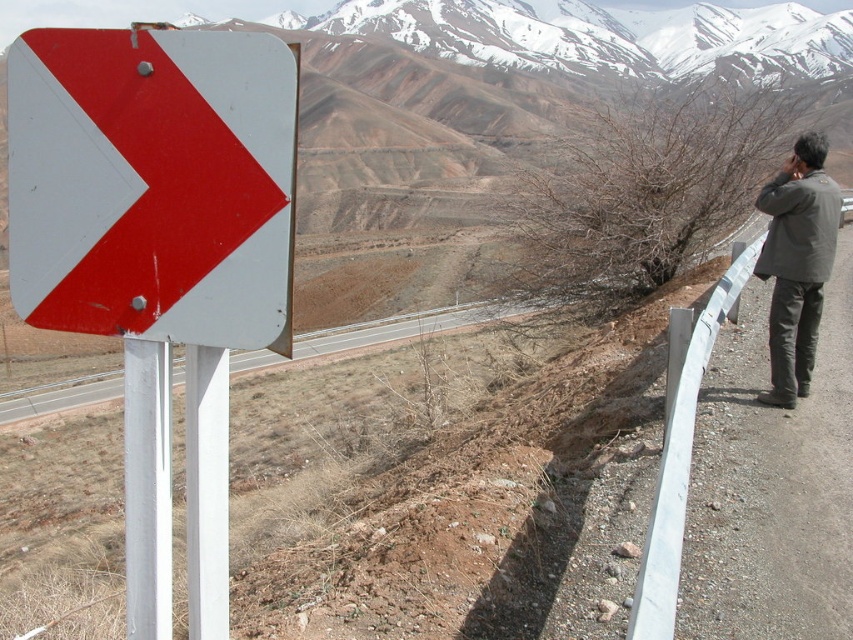
Question: From the image, what is the correct spatial relationship of dark green jacket at right in relation to white metallic pole at left?

Choices:
 (A) right
 (B) left

Answer: (A)

Question: From the image, what is the correct spatial relationship of metallic pole at left in relation to silver metallic guardrail at right?

Choices:
 (A) below
 (B) above

Answer: (A)

Question: Can you confirm if metallic pole at left is thinner than white metallic pole at left?

Choices:
 (A) yes
 (B) no

Answer: (B)

Question: Among these points, which one is nearest to the camera?

Choices:
 (A) (700, 333)
 (B) (283, 180)
 (C) (129, 428)
 (D) (798, 173)

Answer: (B)

Question: Which of the following is the farthest from the observer?

Choices:
 (A) (218, 454)
 (B) (659, 593)
 (C) (120, 230)

Answer: (B)

Question: Which point is farther to the camera?

Choices:
 (A) (x=173, y=268)
 (B) (x=660, y=598)
 (C) (x=169, y=582)

Answer: (B)